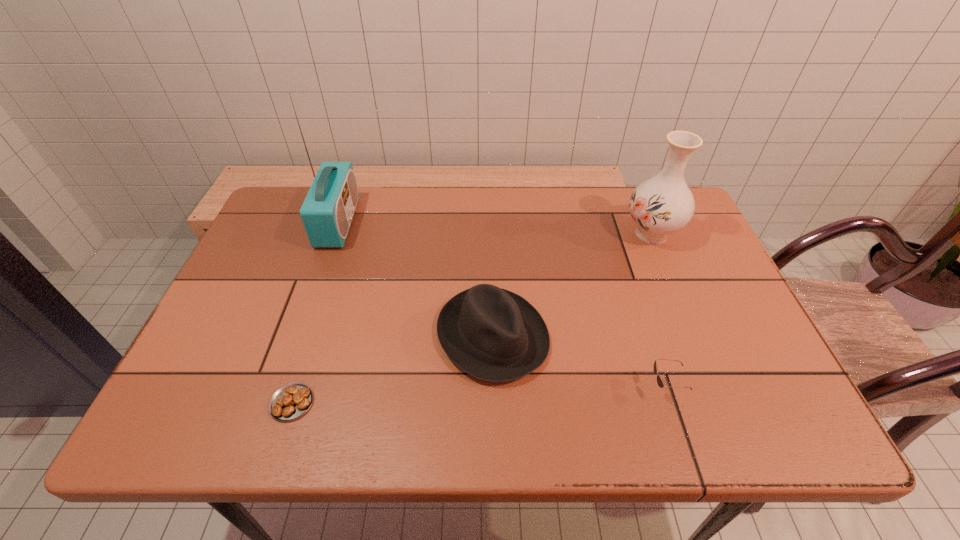
Locate an element on the screen. Image resolution: width=960 pixels, height=540 pixels. the tallest object is located at coordinates (327, 212).

Where is `the second tallest object`? Image resolution: width=960 pixels, height=540 pixels. the second tallest object is located at coordinates (663, 204).

Find the location of a particular element. fedora is located at coordinates (493, 334).

Locate an element on the screen. the third object from right to left is located at coordinates (493, 334).

What are the coordinates of `the fourth tallest object` in the screenshot? It's located at pos(660,382).

The image size is (960, 540). I want to click on pastry, so click(x=291, y=401).

Where is `free region located 0.130m on the front panel of the radio receiver`? This screenshot has height=540, width=960. free region located 0.130m on the front panel of the radio receiver is located at coordinates (399, 222).

In order to click on free space located on the right of the fourth shortest object in this screenshot , I will do `click(698, 234)`.

Where is `free space located 0.230m on the back of the fedora`? This screenshot has height=540, width=960. free space located 0.230m on the back of the fedora is located at coordinates (490, 233).

Locate an element on the screen. blank area located 0.100m in front of the lenses of the sunglasses is located at coordinates (600, 388).